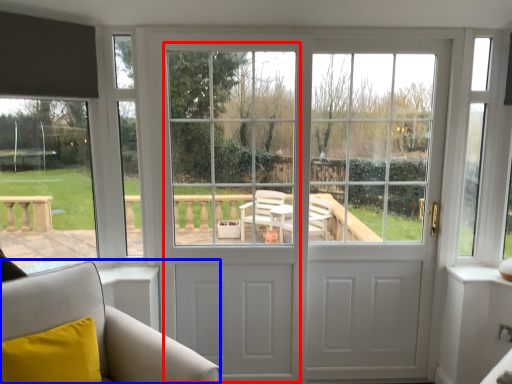
Question: Among these objects, which one is nearest to the camera, screen door (highlighted by a red box) or furniture (highlighted by a blue box)?

Choices:
 (A) screen door
 (B) furniture

Answer: (B)